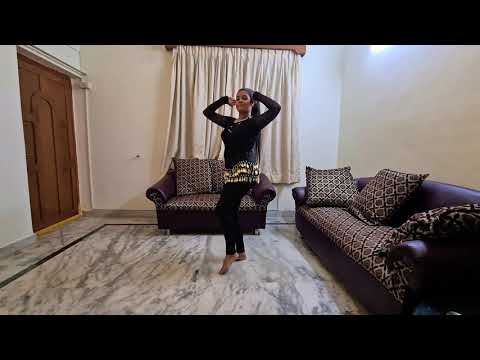
Image resolution: width=480 pixels, height=360 pixels. I want to click on couch, so click(200, 219).